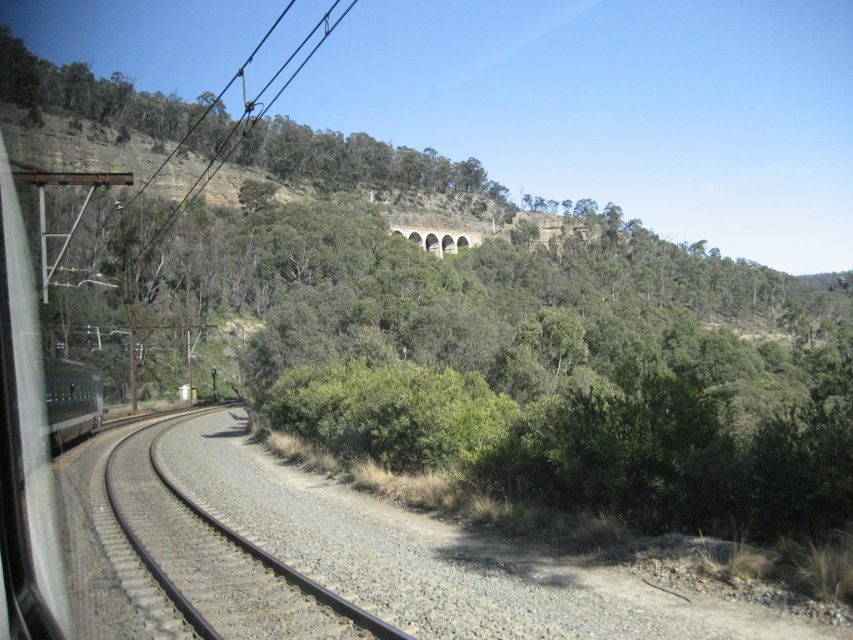
Where is `brown gravel track at center`? brown gravel track at center is located at coordinates (219, 561).

Does brown gravel track at center lie behind green matte train at left?

No, brown gravel track at center is closer to the viewer.

Is point (169, 492) farther from viewer compared to point (48, 417)?

That is False.

Identify the location of brown gravel track at center. (219, 561).

Is green matte train at left further to the viewer compared to stone arch bridge at upper center?

No, green matte train at left is in front of stone arch bridge at upper center.

Is green matte train at left wider than stone arch bridge at upper center?

No.

Between point (79, 385) and point (405, 230), which one is positioned in front?

Point (79, 385) is in front.

Image resolution: width=853 pixels, height=640 pixels. I want to click on green matte train at left, so click(70, 400).

Between brown gravel track at center and stone arch bridge at upper center, which one is positioned higher?

Positioned higher is stone arch bridge at upper center.

Which is behind, point (173, 541) or point (415, 236)?

The point (415, 236) is behind.

This screenshot has width=853, height=640. I want to click on brown gravel track at center, so click(219, 561).